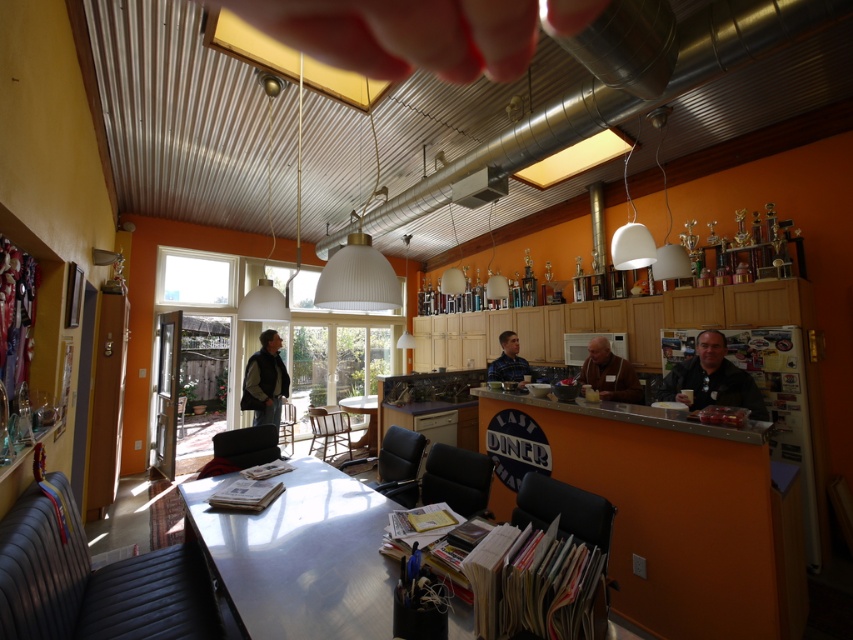
You are a diner customer who wants to sit at the largest table available. Which table should you choose between the metallic silver table at center and the wooden table at center?

The metallic silver table at center has a larger size compared to wooden table at center, so you should choose the metallic silver table at center.

You are a customer entering the diner and want to sit at the table closest to the counter. Which table should you choose between the metallic silver table at center and the wooden table at center?

The metallic silver table at center is shorter than the wooden table at center, so it is closer to the counter. Therefore, you should choose the metallic silver table at center.